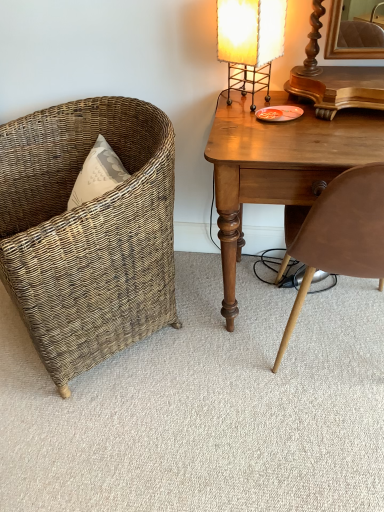
Question: Considering the positions of woven brown chair at left, which is counted as the first chair, starting from the left, and brown leather chair at right, the 2th chair in the left-to-right sequence, in the image, is woven brown chair at left, which is counted as the first chair, starting from the left, wider or thinner than brown leather chair at right, the 2th chair in the left-to-right sequence,?

Choices:
 (A) wide
 (B) thin

Answer: (A)

Question: Considering the positions of woven brown chair at left, which is counted as the first chair, starting from the left, and brown leather chair at right, the 2th chair in the left-to-right sequence, in the image, is woven brown chair at left, which is counted as the first chair, starting from the left, taller or shorter than brown leather chair at right, the 2th chair in the left-to-right sequence,?

Choices:
 (A) short
 (B) tall

Answer: (A)

Question: Estimate the real-world distances between objects in this image. Which object is farther from the woven wicker chair at left?

Choices:
 (A) wooden desk at right
 (B) brown leather chair at right, the 2th chair in the left-to-right sequence
 (C) matte yellow fabric lampshade at upper right
 (D) woven brown chair at left, which is counted as the first chair, starting from the left

Answer: (C)

Question: Estimate the real-world distances between objects in this image. Which object is farther from the woven wicker chair at left?

Choices:
 (A) wooden desk at right
 (B) matte yellow fabric lampshade at upper right
 (C) brown leather chair at right, the first chair when ordered from right to left
 (D) woven brown chair at left, which is counted as the first chair, starting from the left

Answer: (B)